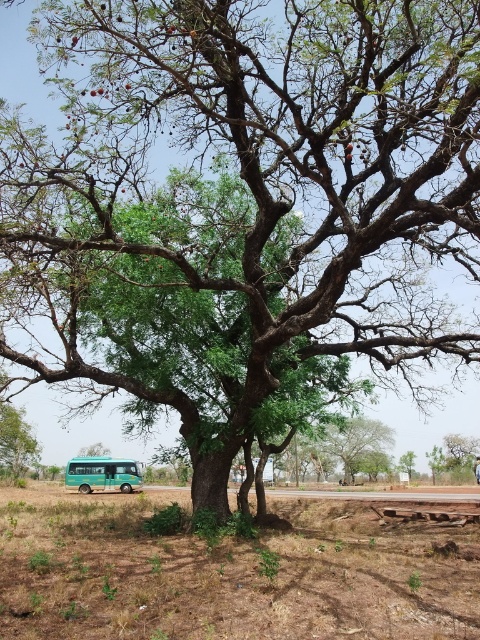
Question: Is green matte bus at lower left positioned in front of green leafy tree at lower left?

Choices:
 (A) yes
 (B) no

Answer: (A)

Question: Is green matte bus at lower left above green leafy tree at center?

Choices:
 (A) yes
 (B) no

Answer: (A)

Question: Which object is closer to the camera taking this photo?

Choices:
 (A) brown dry soil at lower left
 (B) green matte bus at lower left
 (C) green leafy tree at lower left

Answer: (A)

Question: Which point appears closest to the camera in this image?

Choices:
 (A) (84, 472)
 (B) (20, 410)

Answer: (A)

Question: Does brown dry soil at lower left appear on the left side of green matte bus at lower left?

Choices:
 (A) yes
 (B) no

Answer: (B)

Question: Among these objects, which one is nearest to the camera?

Choices:
 (A) green leafy tree at center
 (B) brown dry soil at lower left

Answer: (B)